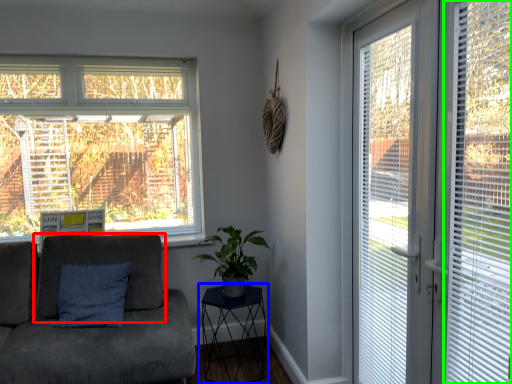
Question: Estimate the real-world distances between objects in this image. Which object is farther from swivel chair (highlighted by a red box), table (highlighted by a blue box) or window blind (highlighted by a green box)?

Choices:
 (A) table
 (B) window blind

Answer: (B)